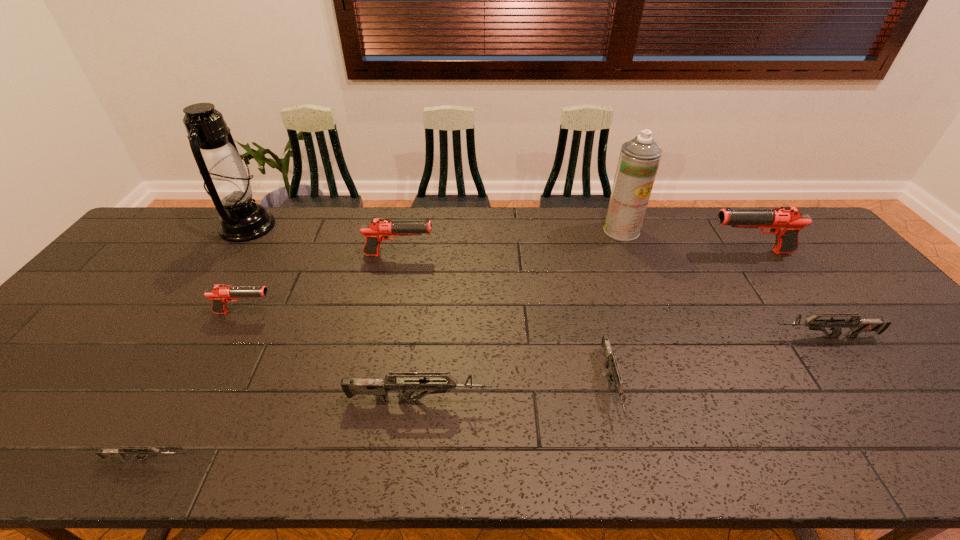
I want to click on gun that stands as the sixth closest to the second biggest grey gun, so click(x=122, y=452).

At what (x,y) coordinates should I click in order to perform the action: click on gun that stands as the sixth closest to the rightmost grey gun. Please return your answer as a coordinate pair (x, y). The height and width of the screenshot is (540, 960). Looking at the image, I should click on (122, 452).

Locate which black gun is the second closest to the leftmost black gun. Please provide its 2D coordinates. Your answer should be formatted as a tuple, i.e. [(x, y)], where the tuple contains the x and y coordinates of a point satisfying the conditions above.

[(785, 222)]

Find the location of a particular element. black gun that is the third nearest to the shortest gun is located at coordinates (785, 222).

The height and width of the screenshot is (540, 960). Find the location of `grey gun that is the closest to the fifth nearest gun`. grey gun that is the closest to the fifth nearest gun is located at coordinates (379, 387).

Locate an element on the screen. This screenshot has width=960, height=540. grey gun identified as the second closest to the fourth tallest object is located at coordinates (610, 359).

Where is `free spot that satisfies the following two spatial constraints: 1. on the front side of the third object from right to left; 2. at the aiming end of the sixth shortest object`? This screenshot has height=540, width=960. free spot that satisfies the following two spatial constraints: 1. on the front side of the third object from right to left; 2. at the aiming end of the sixth shortest object is located at coordinates (631, 255).